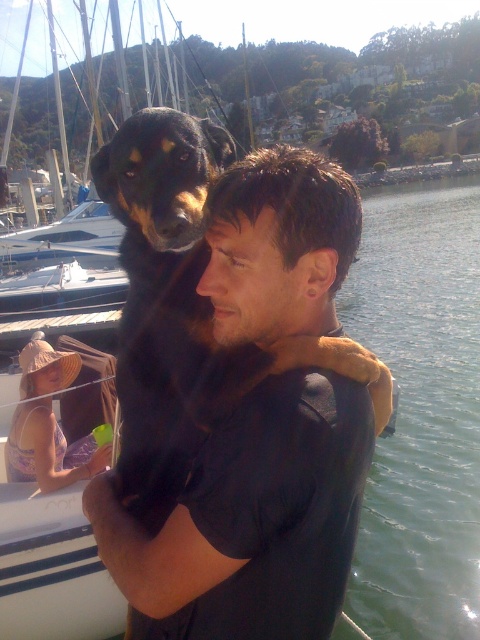
You are a photographer standing at the waterfront. You want to take a photo of the green water at center and the black fur dog at center. Which object is higher in the image?

The green water at center is taller than the black fur dog at center, so the green water at center appears higher in the image.

You are a photographer standing at the waterfront. You want to take a photo that includes both the green water at center and the black fur dog at center. Which object should you zoom in on to ensure both are clearly visible in the frame?

Since the green water at center is bigger than the black fur dog at center, you should zoom in on the black fur dog at center to ensure both fit clearly in the frame.

You are standing at point (363, 378) and want to walk to the point (437, 390). Which direction should you move in to reach there?

To reach point (437, 390) from point (363, 378), you should move backward since point (437, 390) is behind point (363, 378).